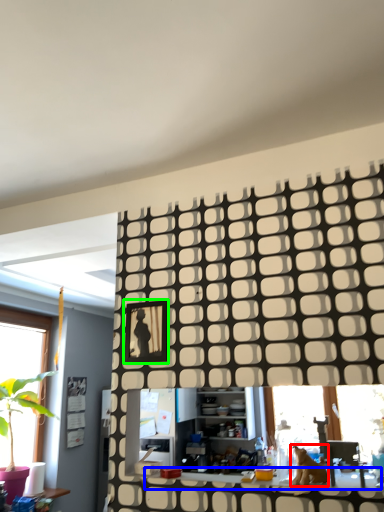
Question: Which is farther away from animal (highlighted by a red box)? counter top (highlighted by a blue box) or picture frame (highlighted by a green box)?

Choices:
 (A) counter top
 (B) picture frame

Answer: (B)